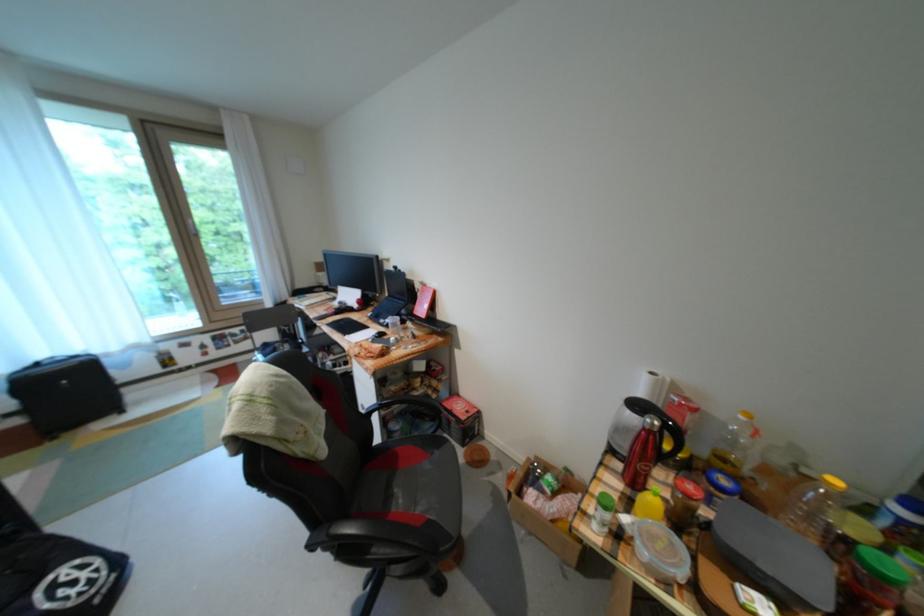
Locate an element on the screen. This screenshot has height=616, width=924. chair sitting surface is located at coordinates (414, 472).